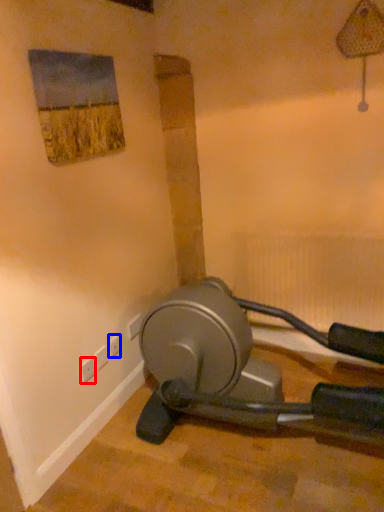
Question: Among these objects, which one is farthest to the camera, electric outlet (highlighted by a red box) or electric outlet (highlighted by a blue box)?

Choices:
 (A) electric outlet
 (B) electric outlet

Answer: (B)